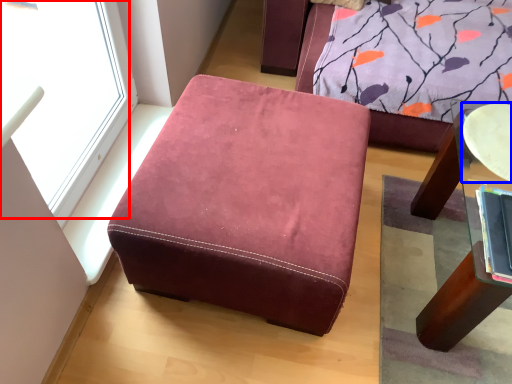
Question: Which point is further to the camera, window (highlighted by a red box) or round table (highlighted by a blue box)?

Choices:
 (A) window
 (B) round table

Answer: (B)